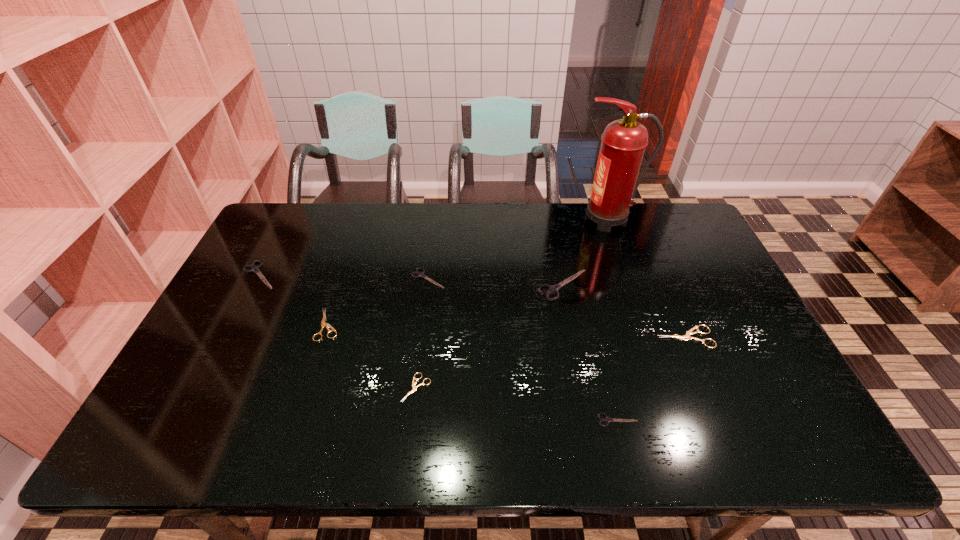
I want to click on the farthest object, so click(x=623, y=142).

Locate an element on the screen. The width and height of the screenshot is (960, 540). red fire extinguisher is located at coordinates (623, 142).

The height and width of the screenshot is (540, 960). I want to click on the tallest shears, so click(x=554, y=289).

The width and height of the screenshot is (960, 540). What are the coordinates of `the seventh shortest object` in the screenshot? It's located at (554, 289).

I want to click on the second tallest shears, so click(255, 269).

You are a GUI agent. You are given a task and a screenshot of the screen. Output one action in this format:
    pyautogui.click(x=<x>, y=<y>)
    Task: Click on the sixth shortest object
    Image resolution: width=960 pixels, height=540 pixels.
    Given the screenshot: What is the action you would take?
    pyautogui.click(x=255, y=269)

Locate an element on the screen. This screenshot has width=960, height=540. the second black shears from left to right is located at coordinates (420, 274).

Identify the location of the biggest beige shears. Image resolution: width=960 pixels, height=540 pixels. (687, 336).

Locate an element on the screen. The height and width of the screenshot is (540, 960). the rightmost shears is located at coordinates (687, 336).

Locate an element on the screen. The height and width of the screenshot is (540, 960). the sixth shears from right to left is located at coordinates (323, 324).